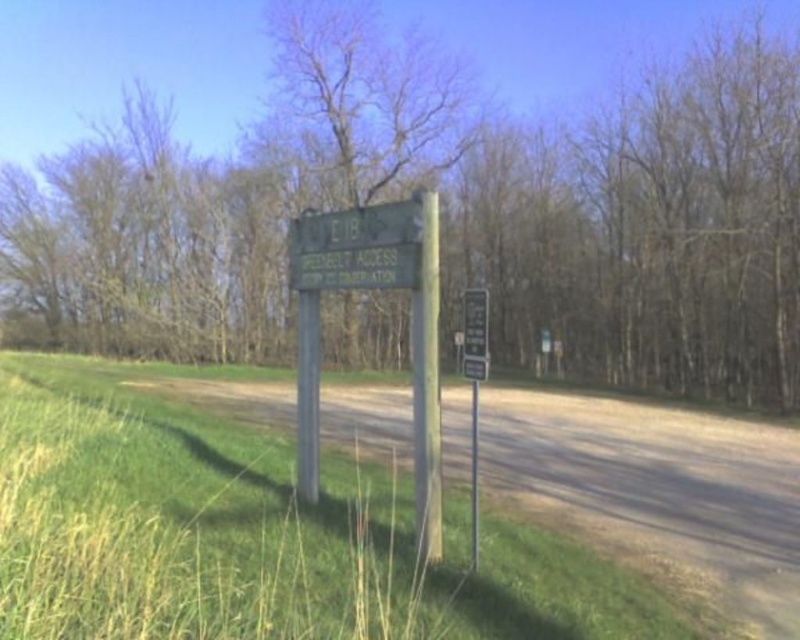
Question: Among these points, which one is nearest to the camera?

Choices:
 (A) (40, 333)
 (B) (413, 257)
 (C) (440, 620)

Answer: (C)

Question: Among these objects, which one is nearest to the camera?

Choices:
 (A) metallic silver signpost at center
 (B) green painted wood pole at center
 (C) wooden post at center

Answer: (A)

Question: Can you confirm if green grass at lower left is positioned below green painted wood pole at center?

Choices:
 (A) yes
 (B) no

Answer: (A)

Question: Which point is farther to the camera?

Choices:
 (A) wooden post at center
 (B) green painted wood pole at center
 (C) green grass at lower left
 (D) gray wood pole at center

Answer: (D)

Question: Is brown wood tree at center behind green wooden sign at center?

Choices:
 (A) yes
 (B) no

Answer: (B)

Question: Is brown wood tree at center thinner than wooden post at center?

Choices:
 (A) no
 (B) yes

Answer: (A)